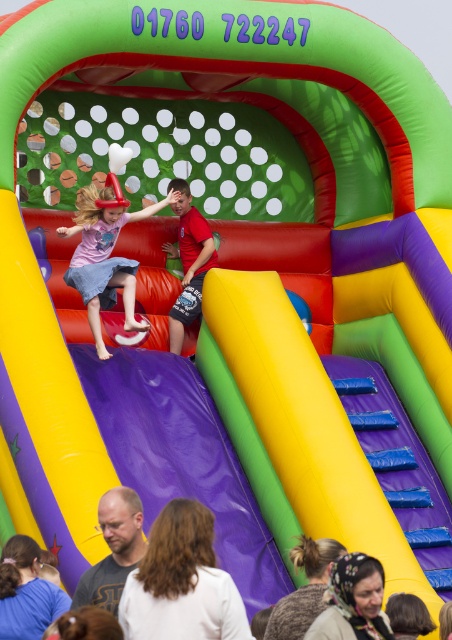
You are standing at the entrance of the bouncy castle and want to find the matte pink dress at center. According to the coordinates given, in which direction should you look to locate it?

The matte pink dress at center is located at coordinates point (104, 257), so you should look towards the center of the bouncy castle to find it.

You are standing at the entrance of the bouncy castle and see two points marked inside. The first point is at coordinates point (107,300) and the second is at point (125,488). If you want to reach the point that is behind the other, which coordinates should you aim for?

Point (107,300) is behind point (125,488), so you should aim for point (107,300).

You are organizing a childrens party and need to ensure safety between the two children. The safety guidelines state that children must stay at least 15 meters apart. Are the matte pink dress at center and white cotton shirt at lower center meeting the requirement?

The matte pink dress at center and white cotton shirt at lower center are 16.35 meters apart, which exceeds the required 15 meters distance. Therefore, they are meeting the safety requirement.